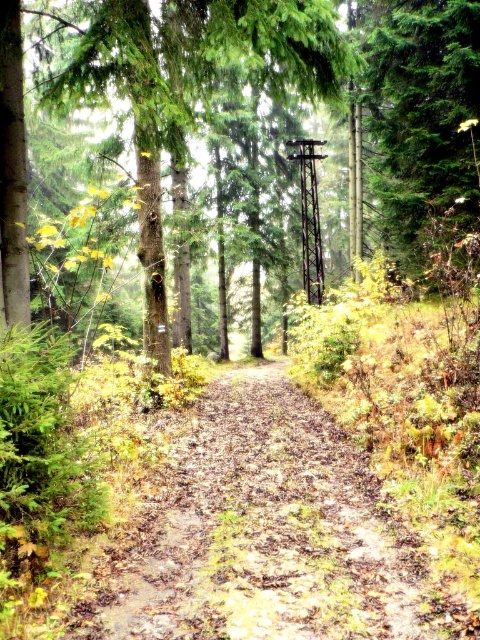
You are a hiker walking along the winding dirt path in the forest. You notice two points marked on the path. The first point is at coordinates point (364,513) and the second point is at coordinates point (443,182). As you walk forward along the path, which point will you encounter first?

Point (364,513) is in front of point (443,182), so you will encounter point (364,513) first as you walk forward along the path.

Looking at this image, you are a hiker trying to navigate the forest path. There is a brown dirt path at center and a green matte tree at center. Which object is closer to the ground?

The brown dirt path at center is positioned under the green matte tree at center, so the dirt path is closer to the ground.